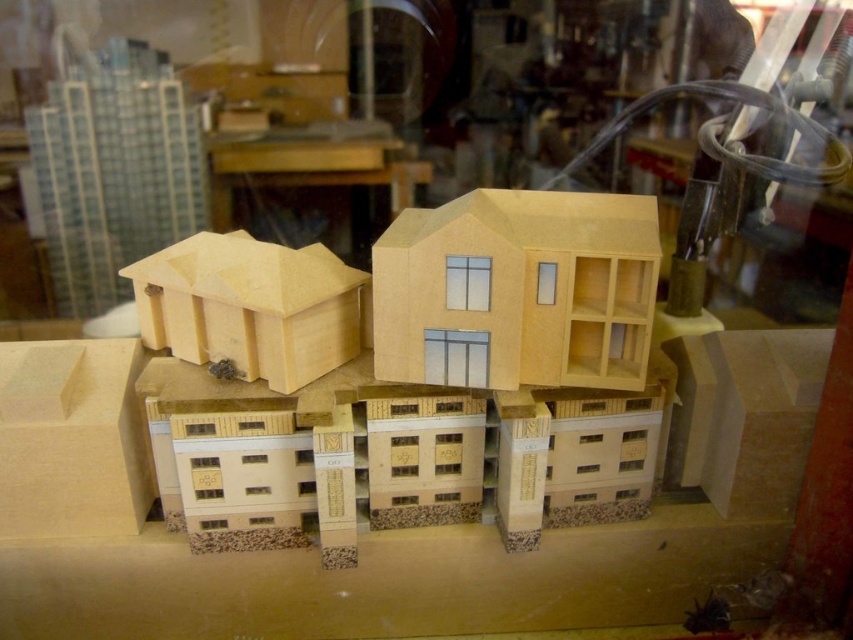
Is clear glass window at center taller than transparent glass shop window at center?

Indeed, clear glass window at center has a greater height compared to transparent glass shop window at center.

At what (x,y) coordinates should I click in order to perform the action: click on clear glass window at center. Please return your answer as a coordinate pair (x, y). Looking at the image, I should click on (467, 282).

Locate an element on the screen. The height and width of the screenshot is (640, 853). clear glass window at center is located at coordinates (467, 282).

Can you confirm if clear glass shop window at center is positioned to the left of transparent glass shop window at center?

Yes, clear glass shop window at center is to the left of transparent glass shop window at center.

Between point (477, 340) and point (544, 298), which one is positioned behind?

The point (477, 340) is more distant.

Does point (439, 380) come closer to viewer compared to point (552, 275)?

No, (439, 380) is further to viewer.

Locate an element on the screen. clear glass shop window at center is located at coordinates (456, 356).

Who is higher up, clear glass shop window at center or clear glass window at center?

clear glass window at center is higher up.

Identify the location of clear glass shop window at center. (456, 356).